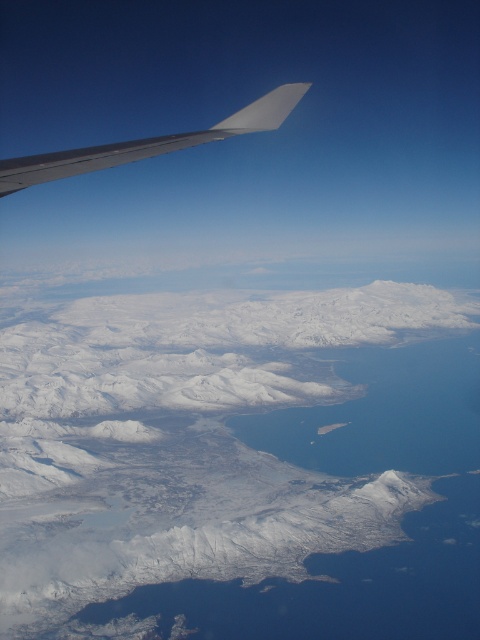
Question: Among these points, which one is farthest from the camera?

Choices:
 (A) (204, 445)
 (B) (285, 108)

Answer: (A)

Question: Does white snow-covered mountains at center appear on the left side of metallic gray wing at upper left?

Choices:
 (A) no
 (B) yes

Answer: (B)

Question: Where is white snow-covered mountains at center located in relation to metallic gray wing at upper left in the image?

Choices:
 (A) right
 (B) left

Answer: (B)

Question: Which point is farther to the camera?

Choices:
 (A) (45, 609)
 (B) (48, 152)

Answer: (B)

Question: Which object is closer to the camera taking this photo?

Choices:
 (A) white snow-covered mountains at center
 (B) metallic gray wing at upper left

Answer: (B)

Question: Is white snow-covered mountains at center above metallic gray wing at upper left?

Choices:
 (A) yes
 (B) no

Answer: (B)